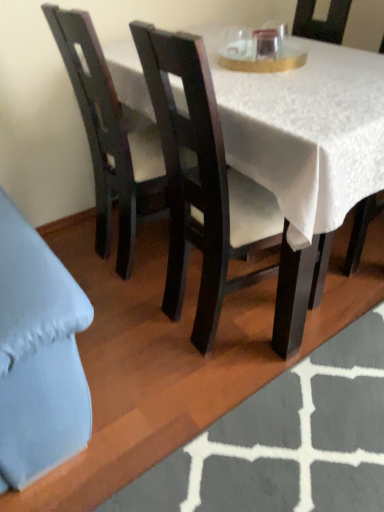
At what (x,y) coordinates should I click in order to perform the action: click on free region under white textured rug at lower center (from a real-world perspective). Please return your answer as a coordinate pair (x, y). The image size is (384, 512). Looking at the image, I should click on (304, 431).